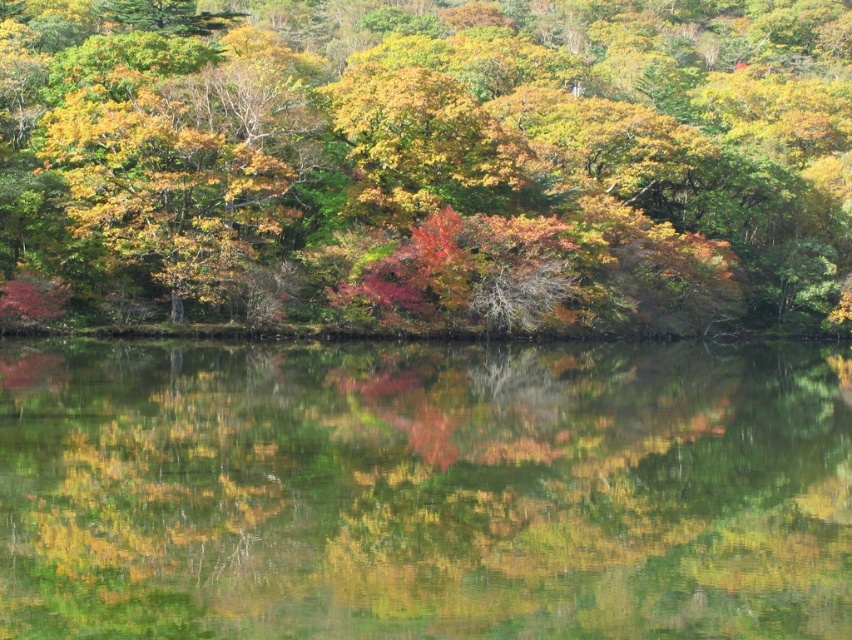
Measure the distance from shiny green leaves at center to green reflective water at center.

A distance of 160.14 feet exists between shiny green leaves at center and green reflective water at center.

In the scene shown: Is shiny green leaves at center above green reflective water at center?

Yes, shiny green leaves at center is above green reflective water at center.

Is point (511, 291) in front of point (605, 609)?

No, (511, 291) is behind (605, 609).

This screenshot has width=852, height=640. Identify the location of shiny green leaves at center. (426, 163).